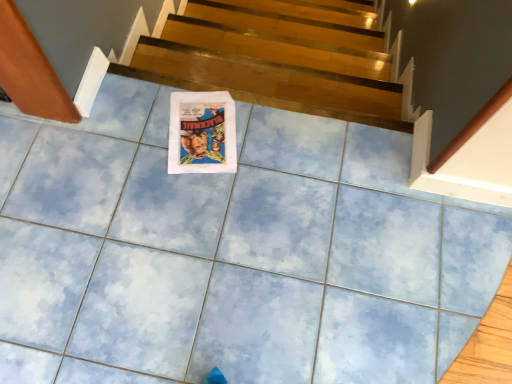
The width and height of the screenshot is (512, 384). What do you see at coordinates (276, 59) in the screenshot?
I see `wooden at upper center` at bounding box center [276, 59].

Find the location of `wooden at upper center`. wooden at upper center is located at coordinates (276, 59).

Describe the element at coordinates (202, 133) in the screenshot. I see `matte paper poster at center` at that location.

In order to face matte paper poster at center, should I rotate leftwards or rightwards?

You should look left and rotate roughly 7.033 degrees.

Where is `matte paper poster at center`? matte paper poster at center is located at coordinates (202, 133).

Where is `wooden at upper center`? This screenshot has height=384, width=512. wooden at upper center is located at coordinates (276, 59).

Which object is positioned more to the left, matte paper poster at center or wooden at upper center?

matte paper poster at center is more to the left.

Is the depth of matte paper poster at center greater than that of wooden at upper center?

No, the depth of matte paper poster at center is less than that of wooden at upper center.

Which is more distant, [197,152] or [345,55]?

The point [345,55] is farther.

From the image's perspective, is matte paper poster at center under wooden at upper center?

Yes.

From the picture: From a real-world perspective, does matte paper poster at center stand above wooden at upper center?

Yes, from a real-world perspective, matte paper poster at center is over wooden at upper center

Considering the sizes of objects matte paper poster at center and wooden at upper center in the image provided, who is wider, matte paper poster at center or wooden at upper center?

Wider between the two is matte paper poster at center.

Looking at this image, does matte paper poster at center have a lesser height compared to wooden at upper center?

Correct, matte paper poster at center is not as tall as wooden at upper center.

Is matte paper poster at center bigger or smaller than wooden at upper center?

matte paper poster at center is smaller than wooden at upper center.

Consider the image. Which is correct: matte paper poster at center is inside wooden at upper center, or outside of it?

matte paper poster at center cannot be found inside wooden at upper center.

Are matte paper poster at center and wooden at upper center making contact?

matte paper poster at center and wooden at upper center are clearly separated.

Is matte paper poster at center looking in the opposite direction of wooden at upper center?

No, wooden at upper center is not at the back of matte paper poster at center.

How many degrees apart are the facing directions of matte paper poster at center and wooden at upper center?

They differ by 14.6 degrees in their facing directions.

Find the location of a particular element. This screenshot has width=512, height=384. poster page lying below the wooden at upper center (from the image's perspective) is located at coordinates (202, 133).

Visually, is wooden at upper center positioned to the left or to the right of matte paper poster at center?

Based on their positions, wooden at upper center is located to the right of matte paper poster at center.

Which object is further away from the camera, wooden at upper center or matte paper poster at center?

Positioned behind is wooden at upper center.

Is point (281, 72) in front of point (199, 164)?

No, it is behind (199, 164).

From the image's perspective, relative to matte paper poster at center, is wooden at upper center above or below?

wooden at upper center is situated higher than matte paper poster at center in the image.

From a real-world perspective, is wooden at upper center positioned under matte paper poster at center based on gravity?

Yes, from a real-world perspective, wooden at upper center is beneath matte paper poster at center.

Which object is wider, wooden at upper center or matte paper poster at center?

matte paper poster at center is wider.

Between wooden at upper center and matte paper poster at center, which one has more height?

With more height is wooden at upper center.

Does wooden at upper center have a smaller size compared to matte paper poster at center?

No.

Would you say wooden at upper center is outside matte paper poster at center?

Yes.

Is wooden at upper center not close to matte paper poster at center?

No, wooden at upper center is in close proximity to matte paper poster at center.

Is wooden at upper center turned away from matte paper poster at center?

That's not correct — wooden at upper center is not looking away from matte paper poster at center.

What's the angular difference between wooden at upper center and matte paper poster at center's facing directions?

The angular difference between wooden at upper center and matte paper poster at center is 14.6 degrees.

I want to click on poster page below the wooden at upper center (from the image's perspective), so click(x=202, y=133).

I want to click on poster page on the left of the wooden at upper center, so click(202, 133).

I want to click on poster page below the wooden at upper center (from the image's perspective), so click(x=202, y=133).